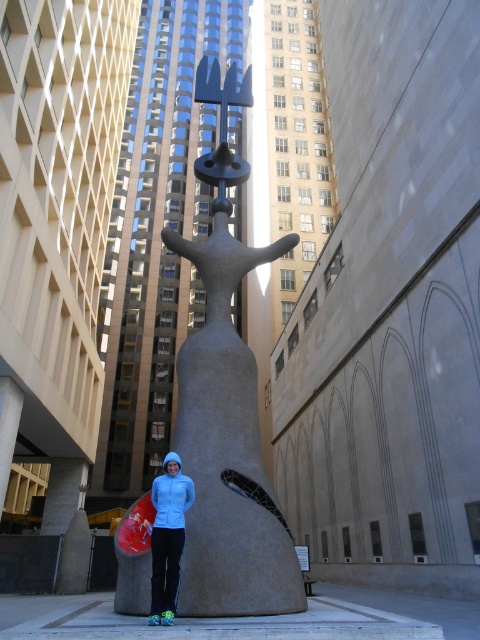
You are a photographer trying to capture the smooth gray statue at center and the light blue fleece at center in a single frame. Based on their positions, can you determine which object will appear larger in the photo?

The smooth gray statue at center is located above light blue fleece at center, so it will appear larger in the photo because it is closer to the camera.

You are standing in the urban scene and want to place a small flag at the location of point (204, 481) and another flag at point (157, 502). According to the scene, which flag will be closer to the viewer?

Point (157, 502) is closer to the viewer than point (204, 481), so the flag at point (157, 502) will be closer.